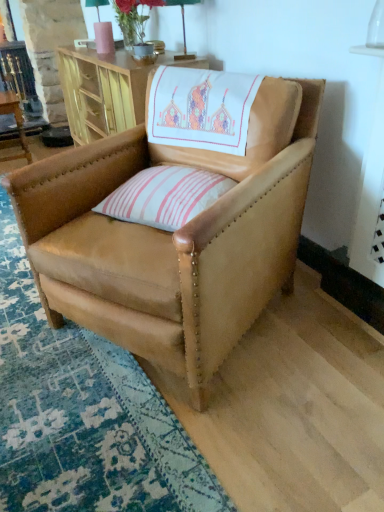
The height and width of the screenshot is (512, 384). Describe the element at coordinates (17, 126) in the screenshot. I see `wooden table at left, the 1th table from the left` at that location.

In order to face matte pink vase at upper center, should I rotate leftwards or rightwards?

It's best to rotate left around 8.572 degrees.

Describe the element at coordinates (165, 196) in the screenshot. I see `pink striped cushion at center` at that location.

Image resolution: width=384 pixels, height=512 pixels. What do you see at coordinates (101, 92) in the screenshot?
I see `wooden cabinet at upper center, which is the second table from left to right` at bounding box center [101, 92].

Identify the location of wooden table at left, arranged as the second table when viewed from the right. (17, 126).

Looking at their sizes, would you say tan leather chair at center is wider or thinner than wooden table at left, arranged as the second table when viewed from the right?

Considering their sizes, tan leather chair at center looks broader than wooden table at left, arranged as the second table when viewed from the right.

From a real-world perspective, relative to wooden table at left, the 1th table from the left, is tan leather chair at center vertically above or below?

tan leather chair at center is above wooden table at left, the 1th table from the left.

Based on the photo, how many degrees apart are the facing directions of tan leather chair at center and wooden table at left, the 1th table from the left?

There is a 29.8-degree angle between the facing directions of tan leather chair at center and wooden table at left, the 1th table from the left.

Between tan leather chair at center and wooden table at left, the 1th table from the left, which one appears on the right side from the viewer's perspective?

tan leather chair at center.

Find the location of `table that appears on the right of wooden table at left, the 1th table from the left`. table that appears on the right of wooden table at left, the 1th table from the left is located at coordinates (101, 92).

How distant is wooden cabinet at upper center, which is the second table from left to right, from wooden table at left, arranged as the second table when viewed from the right?

wooden cabinet at upper center, which is the second table from left to right, and wooden table at left, arranged as the second table when viewed from the right, are 35.84 inches apart from each other.

Is wooden cabinet at upper center, the 1th table when ordered from right to left, not near wooden table at left, the 1th table from the left?

No, there isn't a large distance between wooden cabinet at upper center, the 1th table when ordered from right to left, and wooden table at left, the 1th table from the left.

From the picture: Between wooden cabinet at upper center, the 1th table when ordered from right to left, and wooden table at left, the 1th table from the left, which one appears on the right side from the viewer's perspective?

Positioned to the right is wooden cabinet at upper center, the 1th table when ordered from right to left.

In order to click on table behind the wooden cabinet at upper center, the 1th table when ordered from right to left in this screenshot , I will do `click(17, 126)`.

Is wooden table at left, arranged as the second table when viewed from the right, beside wooden cabinet at upper center, which is the second table from left to right?

No, wooden table at left, arranged as the second table when viewed from the right, is not touching wooden cabinet at upper center, which is the second table from left to right.

Does wooden table at left, arranged as the second table when viewed from the right, come behind wooden cabinet at upper center, which is the second table from left to right?

Yes, the depth of wooden table at left, arranged as the second table when viewed from the right, is greater than that of wooden cabinet at upper center, which is the second table from left to right.

Could wooden cabinet at upper center, which is the second table from left to right, be considered to be inside wooden table at left, arranged as the second table when viewed from the right?

That's incorrect, wooden cabinet at upper center, which is the second table from left to right, is not inside wooden table at left, arranged as the second table when viewed from the right.

Considering the positions of points (145, 22) and (206, 170), is point (145, 22) closer to camera compared to point (206, 170)?

That is False.

Is matte pink vase at upper center taller or shorter than pink striped cushion at center?

In the image, matte pink vase at upper center appears to be taller than pink striped cushion at center.

Considering the positions of objects matte pink vase at upper center and pink striped cushion at center in the image provided, who is more to the right, matte pink vase at upper center or pink striped cushion at center?

Positioned to the right is pink striped cushion at center.

Considering their positions, is matte pink vase at upper center located in front of or behind pink striped cushion at center?

matte pink vase at upper center is behind pink striped cushion at center.

In terms of width, does pink striped cushion at center look wider or thinner when compared to matte pink vase at upper center?

pink striped cushion at center is wider than matte pink vase at upper center.

Is pink striped cushion at center turned away from matte pink vase at upper center?

That's not correct — pink striped cushion at center is not looking away from matte pink vase at upper center.

Is pink striped cushion at center placed right next to matte pink vase at upper center?

No, pink striped cushion at center is not with matte pink vase at upper center.

Based on the photo, who is shorter, pink striped cushion at center or matte pink vase at upper center?

pink striped cushion at center is shorter.

Can you confirm if tan leather chair at center is taller than wooden cabinet at upper center, the 1th table when ordered from right to left?

Indeed, tan leather chair at center has a greater height compared to wooden cabinet at upper center, the 1th table when ordered from right to left.

From the image's perspective, between tan leather chair at center and wooden cabinet at upper center, which is the second table from left to right, who is located below?

From the image's view, tan leather chair at center is below.

Is tan leather chair at center inside or outside of wooden cabinet at upper center, which is the second table from left to right?

tan leather chair at center is not inside wooden cabinet at upper center, which is the second table from left to right, it's outside.

Image resolution: width=384 pixels, height=512 pixels. In the image, there is a wooden cabinet at upper center, the 1th table when ordered from right to left. In order to click on chair below it (from a real-world perspective) in this screenshot , I will do `click(173, 237)`.

Is matte pink vase at upper center at the back of wooden cabinet at upper center, the 1th table when ordered from right to left?

That's not correct — wooden cabinet at upper center, the 1th table when ordered from right to left, is not looking away from matte pink vase at upper center.

At what (x,y) coordinates should I click in order to perform the action: click on the 1st table directly beneath the matte pink vase at upper center (from a real-world perspective). Please return your answer as a coordinate pair (x, y). This screenshot has width=384, height=512. Looking at the image, I should click on (101, 92).

Can you see wooden cabinet at upper center, which is the second table from left to right, touching matte pink vase at upper center?

wooden cabinet at upper center, which is the second table from left to right, and matte pink vase at upper center are not in contact.

Identify the location of the 2nd table to the left of the tan leather chair at center, starting your count from the anchor. The image size is (384, 512). (17, 126).

This screenshot has height=512, width=384. In order to click on table below the wooden table at left, the 1th table from the left (from the image's perspective) in this screenshot , I will do `click(101, 92)`.

Estimate the real-world distances between objects in this image. Which object is further from wooden table at left, arranged as the second table when viewed from the right, tan leather chair at center or wooden cabinet at upper center, which is the second table from left to right?

Based on the image, tan leather chair at center appears to be further to wooden table at left, arranged as the second table when viewed from the right.

Looking at this image, considering their positions, is wooden cabinet at upper center, the 1th table when ordered from right to left, positioned further to tan leather chair at center than pink striped cushion at center?

wooden cabinet at upper center, the 1th table when ordered from right to left.

Estimate the real-world distances between objects in this image. Which object is further from tan leather chair at center, matte pink vase at upper center or wooden table at left, arranged as the second table when viewed from the right?

wooden table at left, arranged as the second table when viewed from the right.

Considering their positions, is wooden table at left, the 1th table from the left, positioned further to tan leather chair at center than pink striped cushion at center?

wooden table at left, the 1th table from the left, is further to tan leather chair at center.

From the picture: From the image, which object appears to be nearer to wooden table at left, the 1th table from the left, pink striped cushion at center or matte pink vase at upper center?

matte pink vase at upper center.

Looking at the image, which one is located further to matte pink vase at upper center, wooden table at left, the 1th table from the left, or wooden cabinet at upper center, the 1th table when ordered from right to left?

wooden table at left, the 1th table from the left, is positioned further to the anchor matte pink vase at upper center.

In the scene shown: Based on their spatial positions, is tan leather chair at center or matte pink vase at upper center further from wooden table at left, arranged as the second table when viewed from the right?

tan leather chair at center.

From the image, which object appears to be nearer to matte pink vase at upper center, pink striped cushion at center or tan leather chair at center?

pink striped cushion at center is positioned closer to the anchor matte pink vase at upper center.

Where is `pillow located between tan leather chair at center and wooden table at left, arranged as the second table when viewed from the right, in the depth direction`? pillow located between tan leather chair at center and wooden table at left, arranged as the second table when viewed from the right, in the depth direction is located at coordinates (165, 196).

Where is `flower between tan leather chair at center and wooden table at left, the 1th table from the left, along the z-axis`? The width and height of the screenshot is (384, 512). flower between tan leather chair at center and wooden table at left, the 1th table from the left, along the z-axis is located at coordinates (133, 18).

You are a GUI agent. You are given a task and a screenshot of the screen. Output one action in this format:
    pyautogui.click(x=<x>, y=<y>)
    Task: Click on the table between wooden table at left, arranged as the second table when viewed from the right, and matte pink vase at upper center from left to right
    
    Given the screenshot: What is the action you would take?
    pyautogui.click(x=101, y=92)

The height and width of the screenshot is (512, 384). Find the location of `flower positioned between pink striped cushion at center and wooden table at left, the 1th table from the left, from near to far`. flower positioned between pink striped cushion at center and wooden table at left, the 1th table from the left, from near to far is located at coordinates (133, 18).